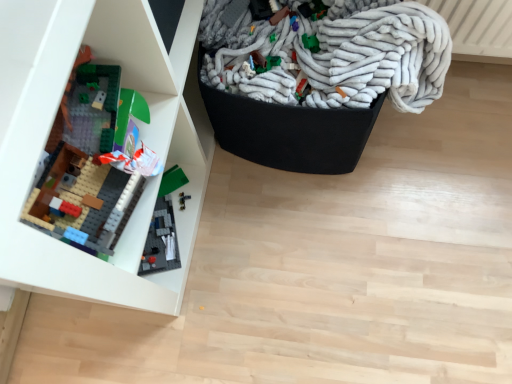
The image size is (512, 384). Identify the location of vacant space to the right of matte plastic lego set at left. (344, 226).